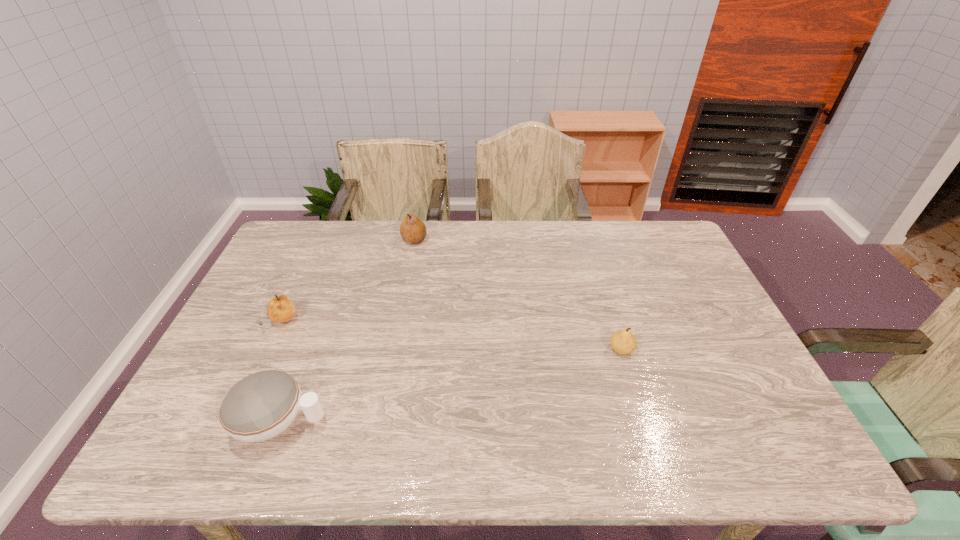
Locate an element on the screen. The width and height of the screenshot is (960, 540). object that can be found as the closest to the third nearest object is located at coordinates (260, 406).

The height and width of the screenshot is (540, 960). What are the coordinates of `object that is the third closest to the second object from right to left` in the screenshot? It's located at (623, 342).

In order to click on the second closest pear to the farthest object in this screenshot , I will do `click(623, 342)`.

Identify the location of the second closest pear to the farthest pear. (623, 342).

This screenshot has width=960, height=540. In order to click on free space that satisfies the following two spatial constraints: 1. on the front side of the rightmost pear; 2. on the right side of the leftmost pear in this screenshot , I will do `click(270, 350)`.

At what (x,y) coordinates should I click in order to perform the action: click on vacant space that satisfies the following two spatial constraints: 1. on the front side of the farthest object; 2. on the left side of the rightmost object. Please return your answer as a coordinate pair (x, y). Looking at the image, I should click on (394, 350).

Identify the location of vacant region that satisfies the following two spatial constraints: 1. on the front side of the rightmost pear; 2. on the side with the handle of the chinaware. This screenshot has width=960, height=540. (643, 422).

Where is `free space that satisfies the following two spatial constraints: 1. on the back side of the farthest pear; 2. on the left side of the second farthest object`? This screenshot has height=540, width=960. free space that satisfies the following two spatial constraints: 1. on the back side of the farthest pear; 2. on the left side of the second farthest object is located at coordinates (321, 240).